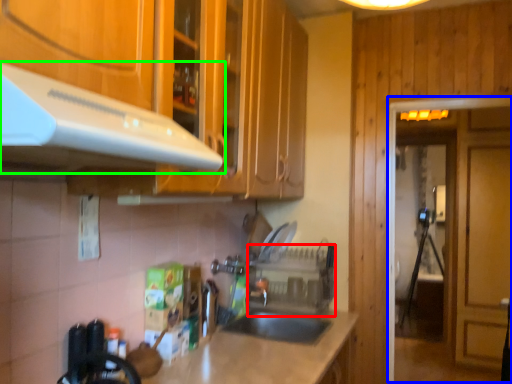
Question: Estimate the real-world distances between objects in this image. Which object is farther from appliance (highlighted by a red box), glass door (highlighted by a blue box) or exhaust hood (highlighted by a green box)?

Choices:
 (A) glass door
 (B) exhaust hood

Answer: (B)